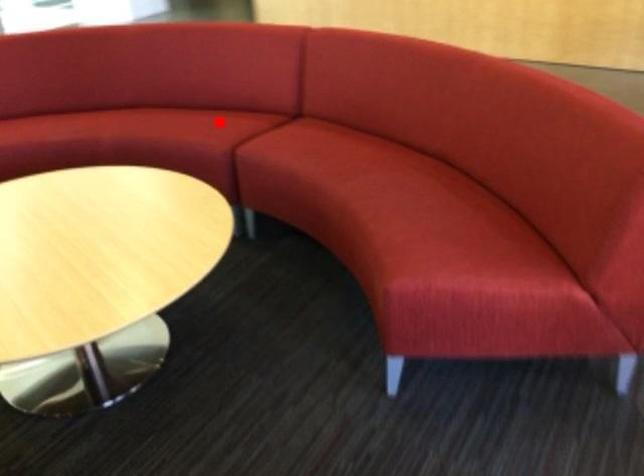
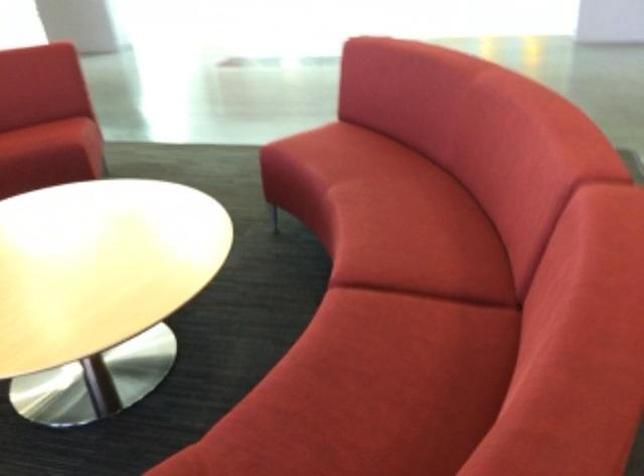
Find the pixel in the second image that matches the highlighted location in the first image.

(418, 239)